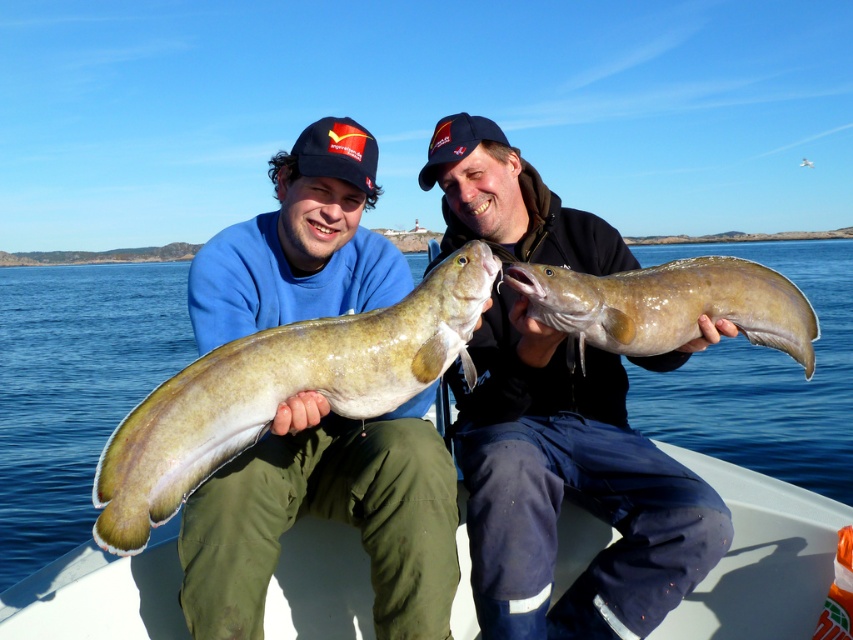
This screenshot has width=853, height=640. Describe the element at coordinates (759, 557) in the screenshot. I see `white plastic boat at lower center` at that location.

Is white plastic boat at lower center below brown leather fish at center?

Yes, white plastic boat at lower center is below brown leather fish at center.

Where is `white plastic boat at lower center`? white plastic boat at lower center is located at coordinates (759, 557).

Does smooth yellowish fish at center appear under greenish-yellow rubber fish at center?

Actually, smooth yellowish fish at center is above greenish-yellow rubber fish at center.

Which is more to the right, smooth yellowish fish at center or greenish-yellow rubber fish at center?

From the viewer's perspective, smooth yellowish fish at center appears more on the right side.

In order to click on smooth yellowish fish at center in this screenshot , I will do `click(572, 488)`.

Does smooth yellowish fish at center appear on the right side of white plastic boat at lower center?

In fact, smooth yellowish fish at center is to the left of white plastic boat at lower center.

Looking at this image, between smooth yellowish fish at center and white plastic boat at lower center, which one has more height?

smooth yellowish fish at center

Measure the distance between point (526, 227) and camera.

2.89 meters

The width and height of the screenshot is (853, 640). I want to click on smooth yellowish fish at center, so click(x=572, y=488).